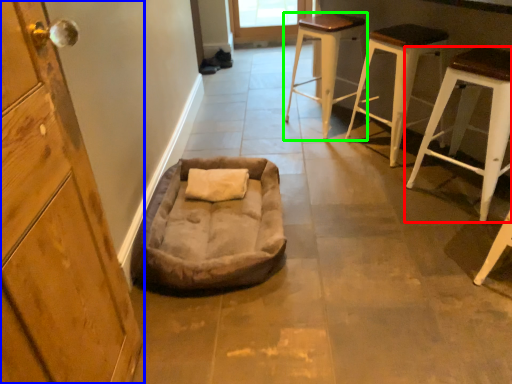
Question: Which is nearer to the stool (highlighted by a red box)? cabinetry (highlighted by a blue box) or stool (highlighted by a green box).

Choices:
 (A) cabinetry
 (B) stool

Answer: (B)